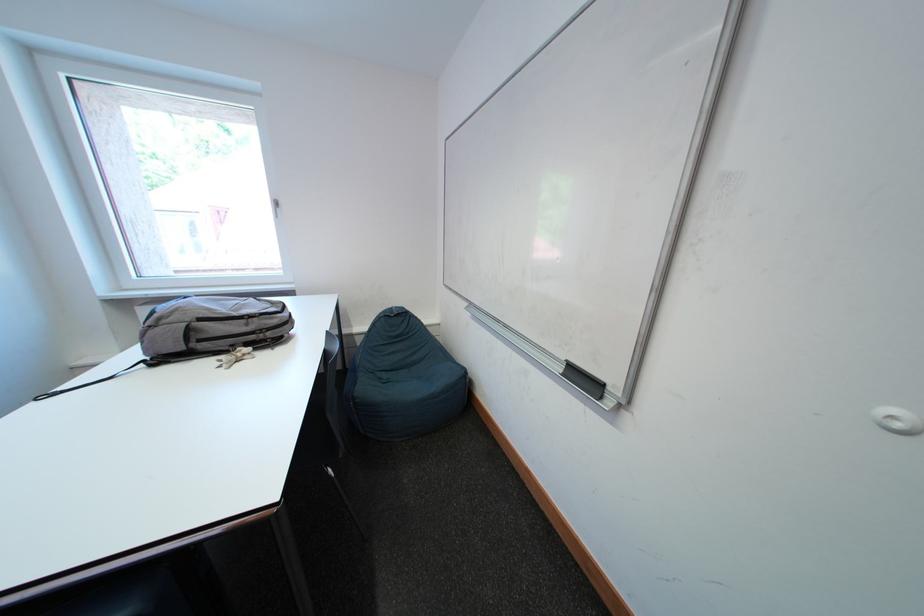
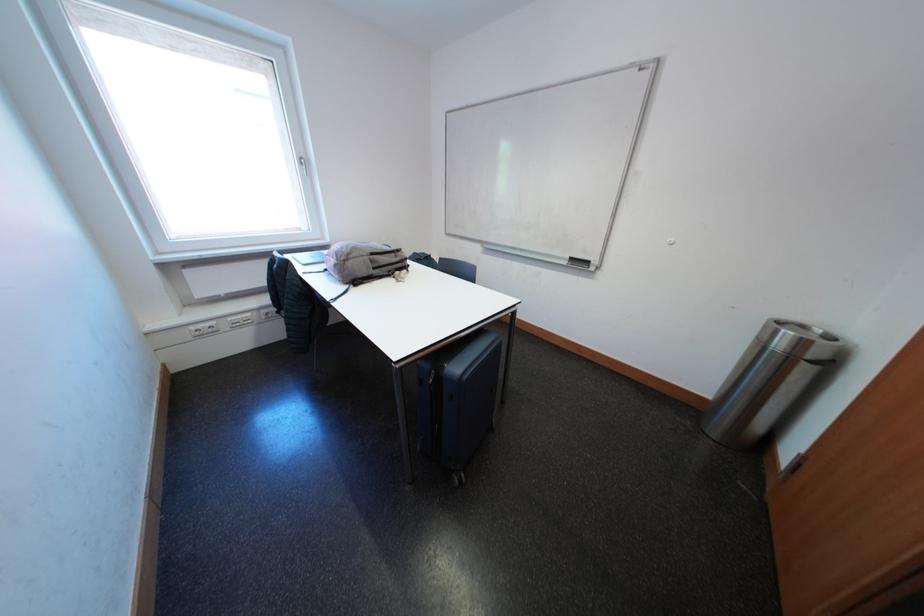
In the second image, find the point that corresponds to (257,328) in the first image.

(406, 261)